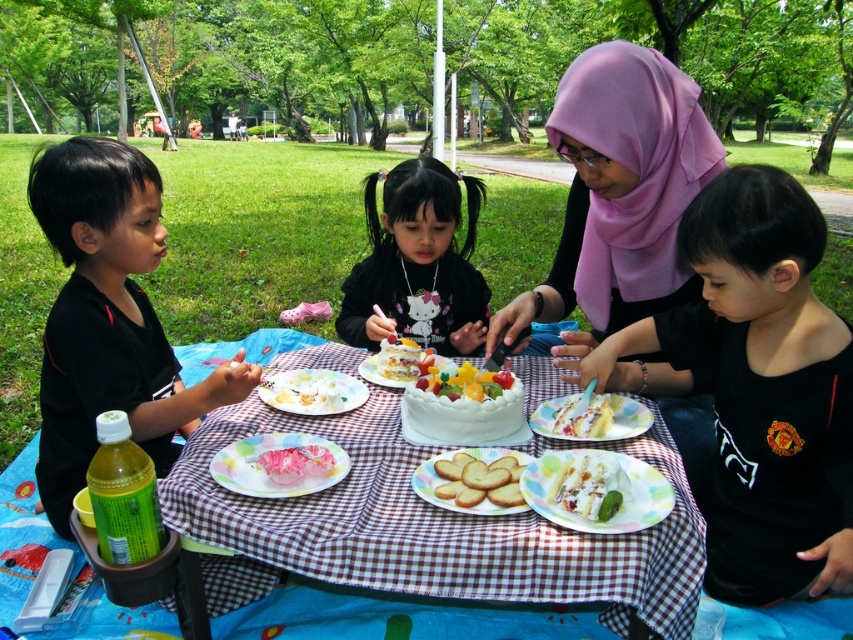
You are a caterer setting up for a picnic. You have a white fabric table at center and a pastel floral plate at center. The plate needs to be placed exactly 8 inches away from the table. Is the current placement correct?

The distance between the white fabric table at center and the pastel floral plate at center is 7.39 inches, which is less than 8 inches. The plate needs to be moved further away to meet the requirement.

You are planning to place a new item on the picnic setup. Given the coordinates of the white fabric table at center, where would you position it relative to the blue picnic blanket with a colorful design?

The white fabric table at center is located at point coordinates (426, 529) relative to the blue picnic blanket with a colorful design.